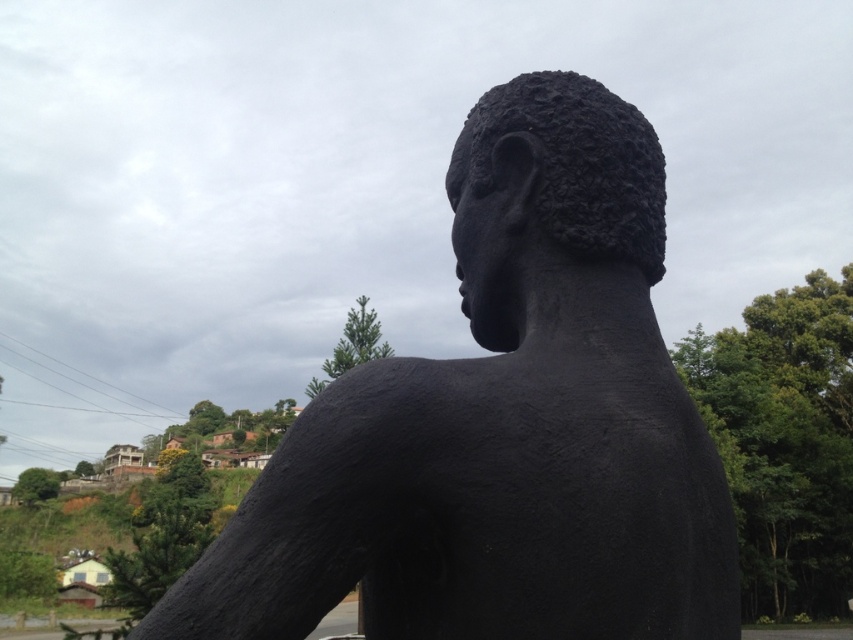
The width and height of the screenshot is (853, 640). Describe the element at coordinates (502, 426) in the screenshot. I see `black matte bust at center` at that location.

Does point (489, 285) come behind point (529, 100)?

Yes, it is behind point (529, 100).

Describe the element at coordinates (502, 426) in the screenshot. I see `black matte bust at center` at that location.

This screenshot has width=853, height=640. What are the coordinates of `black matte bust at center` in the screenshot? It's located at (502, 426).